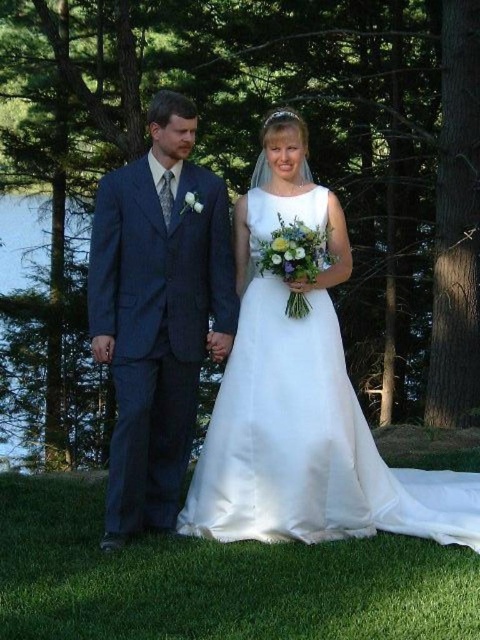
Question: Which point is closer to the camera?

Choices:
 (A) (146, 227)
 (B) (338, 392)

Answer: (A)

Question: Is white satin dress at center to the left of dark blue suit at left from the viewer's perspective?

Choices:
 (A) yes
 (B) no

Answer: (B)

Question: Is white satin dress at center to the right of dark blue suit at left from the viewer's perspective?

Choices:
 (A) yes
 (B) no

Answer: (A)

Question: Is white satin dress at center above dark blue suit at left?

Choices:
 (A) yes
 (B) no

Answer: (B)